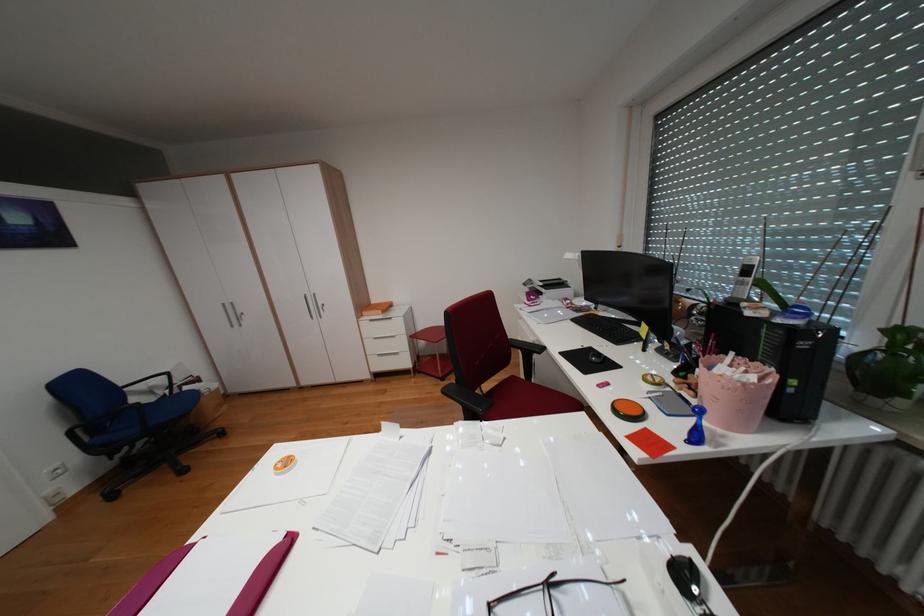
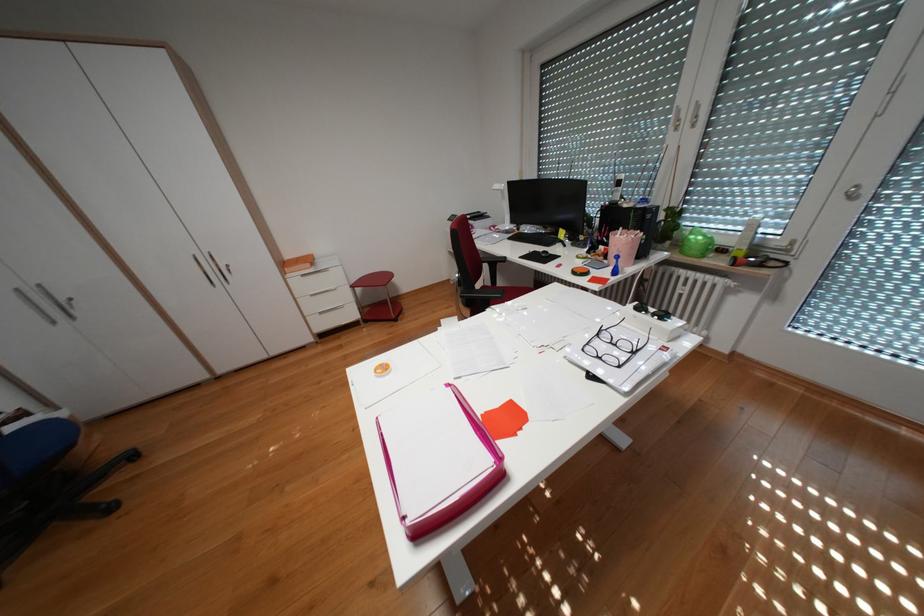
Where in the second image is the point corresponding to the point at 602,347 from the first image?

(546, 252)